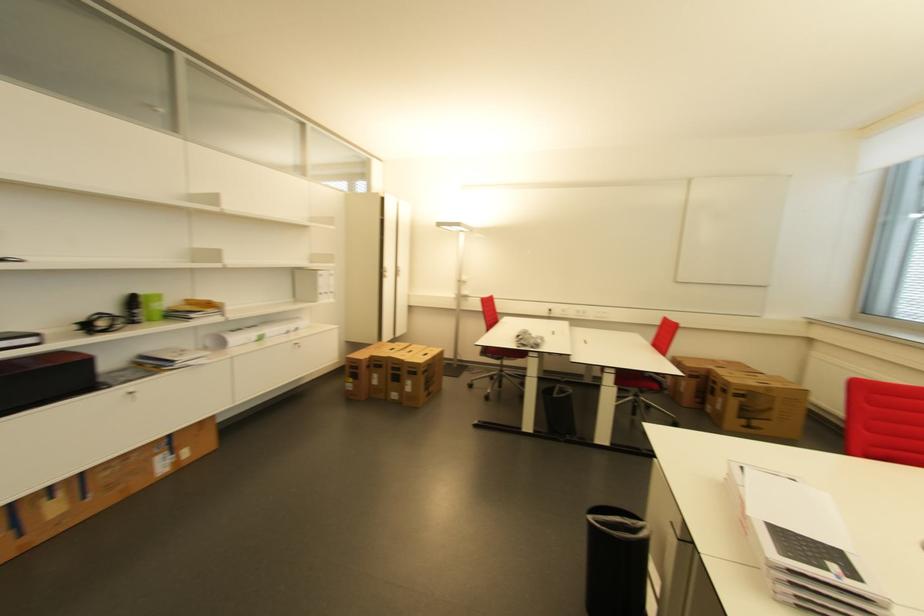
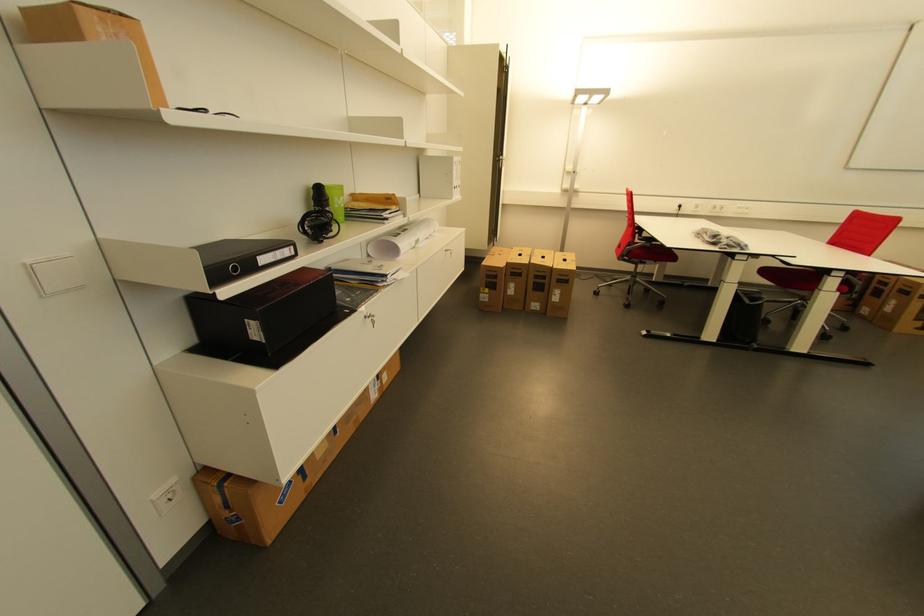
In the second image, find the point that corresponds to [147,301] in the first image.

(333, 193)